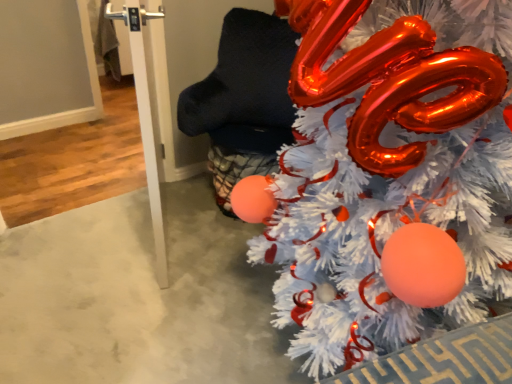
Question: Is white glossy door handle at left looking in the opposite direction of white fluffy christmas tree at right?

Choices:
 (A) no
 (B) yes

Answer: (B)

Question: Does white glossy door handle at left contain white fluffy christmas tree at right?

Choices:
 (A) no
 (B) yes

Answer: (A)

Question: From a real-world perspective, is white glossy door handle at left located higher than white fluffy christmas tree at right?

Choices:
 (A) no
 (B) yes

Answer: (A)

Question: Considering the relative sizes of white glossy door handle at left and white fluffy christmas tree at right in the image provided, is white glossy door handle at left shorter than white fluffy christmas tree at right?

Choices:
 (A) yes
 (B) no

Answer: (A)

Question: Is white glossy door handle at left to the right of white fluffy christmas tree at right from the viewer's perspective?

Choices:
 (A) yes
 (B) no

Answer: (B)

Question: From the image's perspective, is white glossy door handle at left under white fluffy christmas tree at right?

Choices:
 (A) no
 (B) yes

Answer: (A)

Question: Considering the relative sizes of white fluffy christmas tree at right and white glossy door handle at left in the image provided, is white fluffy christmas tree at right thinner than white glossy door handle at left?

Choices:
 (A) no
 (B) yes

Answer: (A)

Question: From the image's perspective, is white fluffy christmas tree at right below white glossy door handle at left?

Choices:
 (A) yes
 (B) no

Answer: (A)

Question: Considering the relative positions of white fluffy christmas tree at right and white glossy door handle at left in the image provided, is white fluffy christmas tree at right in front of white glossy door handle at left?

Choices:
 (A) yes
 (B) no

Answer: (A)

Question: From a real-world perspective, is white fluffy christmas tree at right physically above white glossy door handle at left?

Choices:
 (A) no
 (B) yes

Answer: (B)

Question: Is white fluffy christmas tree at right wider than white glossy door handle at left?

Choices:
 (A) no
 (B) yes

Answer: (B)

Question: Does white fluffy christmas tree at right lie behind white glossy door handle at left?

Choices:
 (A) no
 (B) yes

Answer: (A)

Question: From the image's perspective, is white glossy door handle at left located above or below white fluffy christmas tree at right?

Choices:
 (A) above
 (B) below

Answer: (A)